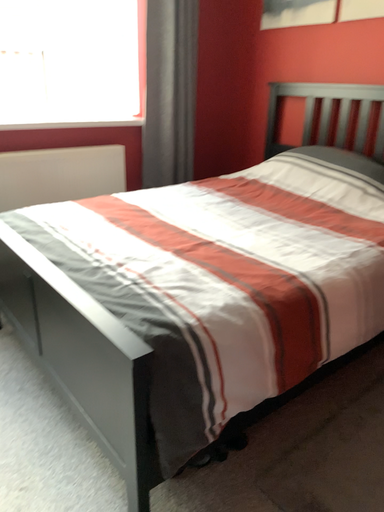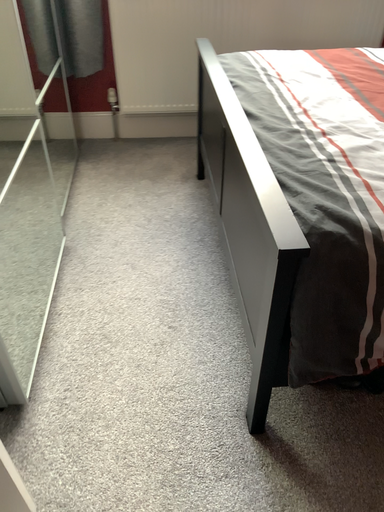
Question: Which way did the camera rotate in the video?

Choices:
 (A) rotated right
 (B) rotated left

Answer: (B)